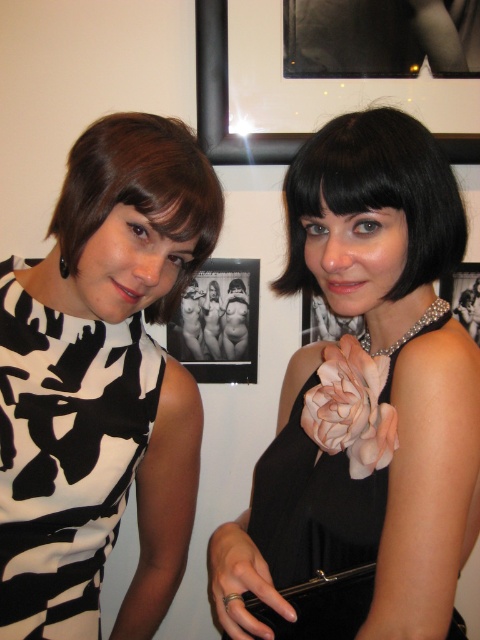
Question: Can you confirm if black satin dress at right is positioned above black silk dress at center?

Choices:
 (A) no
 (B) yes

Answer: (A)

Question: Which object appears farthest from the camera in this image?

Choices:
 (A) black matte picture frame at center
 (B) matte black dress at left

Answer: (A)

Question: Can you confirm if black printed fabric dress at left is wider than black silk dress at center?

Choices:
 (A) no
 (B) yes

Answer: (A)

Question: Observing the image, what is the correct spatial positioning of black satin dress at right in reference to matte black dress at left?

Choices:
 (A) right
 (B) left

Answer: (A)

Question: Among these points, which one is nearest to the camera?

Choices:
 (A) (213, 147)
 (B) (252, 264)
 (C) (72, 237)
 (D) (391, 292)

Answer: (C)

Question: Which point is closer to the camera?

Choices:
 (A) metallic silver frame at upper center
 (B) black printed fabric dress at left

Answer: (B)